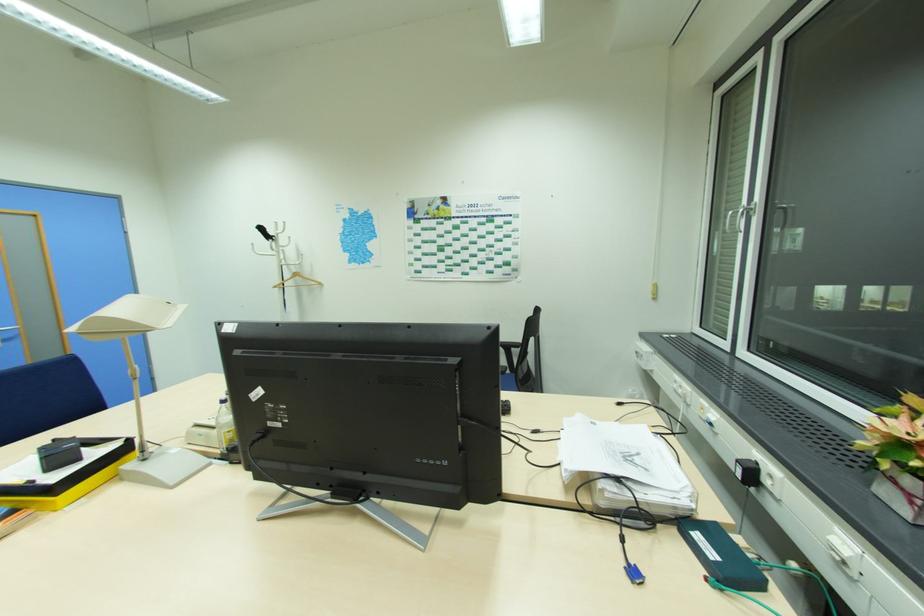
Find where to lift the plastic water bottle. Please return your answer as a coordinate pair (x, y).

(225, 426)